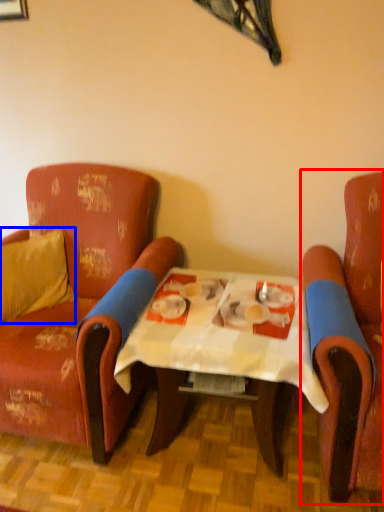
Question: Which of the following is the closest to the observer, chair (highlighted by a red box) or pillow (highlighted by a blue box)?

Choices:
 (A) chair
 (B) pillow

Answer: (A)